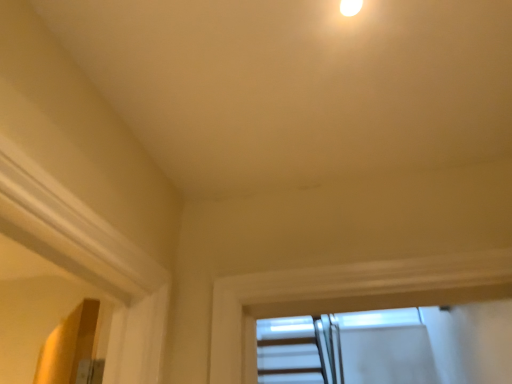
Identify the location of white glossy droplight at upper center. (350, 7).

What do you see at coordinates (350, 7) in the screenshot? I see `white glossy droplight at upper center` at bounding box center [350, 7].

The width and height of the screenshot is (512, 384). I want to click on white glossy droplight at upper center, so click(x=350, y=7).